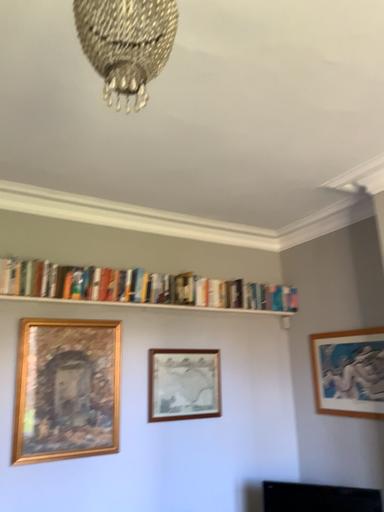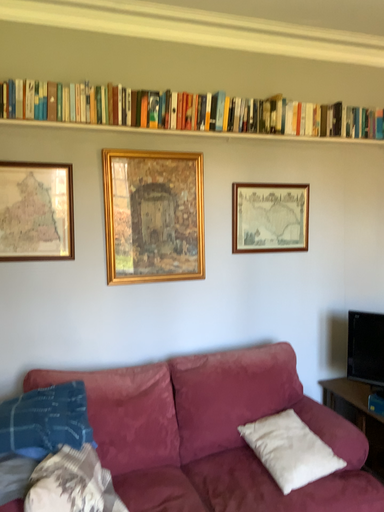
Question: Which way did the camera rotate in the video?

Choices:
 (A) rotated downward
 (B) rotated upward

Answer: (A)